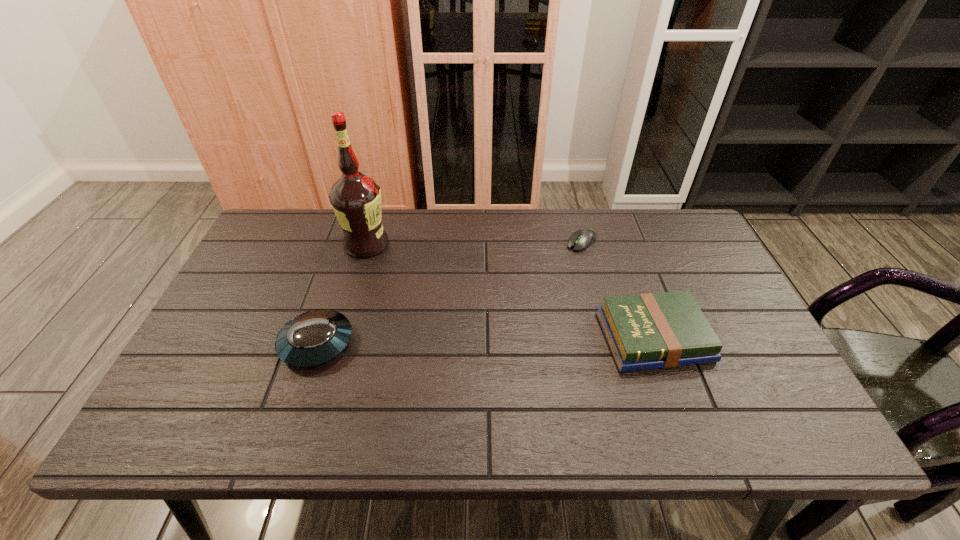
Where is `free point between the computer mouse and the saucer`? The width and height of the screenshot is (960, 540). free point between the computer mouse and the saucer is located at coordinates (449, 292).

Image resolution: width=960 pixels, height=540 pixels. Identify the location of free spot between the computer mouse and the book. (617, 289).

Find the location of a particular element. The image size is (960, 540). object that is the third closest to the book is located at coordinates (313, 338).

The width and height of the screenshot is (960, 540). In order to click on the third closest object to the computer mouse in this screenshot , I will do `click(313, 338)`.

This screenshot has height=540, width=960. Identify the location of free space that satisfies the following two spatial constraints: 1. on the front side of the computer mouse; 2. on the right side of the book. (607, 338).

In order to click on free location that satisfies the following two spatial constraints: 1. on the back side of the saucer; 2. on the left side of the shortest object in this screenshot , I will do `click(350, 241)`.